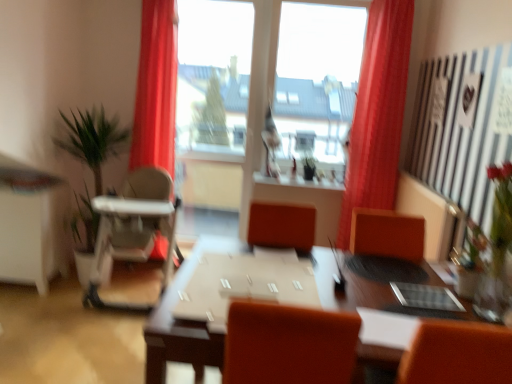
Question: Does brown wooden table at center have a lesser width compared to transparent glass window at center?

Choices:
 (A) no
 (B) yes

Answer: (A)

Question: Is brown wooden table at center completely or partially outside of transparent glass window at center?

Choices:
 (A) yes
 (B) no

Answer: (A)

Question: From a real-world perspective, does brown wooden table at center sit lower than transparent glass window at center?

Choices:
 (A) no
 (B) yes

Answer: (B)

Question: Is brown wooden table at center further to the viewer compared to transparent glass window at center?

Choices:
 (A) no
 (B) yes

Answer: (A)

Question: Considering the relative sizes of brown wooden table at center and transparent glass window at center in the image provided, is brown wooden table at center wider than transparent glass window at center?

Choices:
 (A) yes
 (B) no

Answer: (A)

Question: From a real-world perspective, is transparent glass window at center above or below clear glass vase at right?

Choices:
 (A) above
 (B) below

Answer: (A)

Question: Considering their positions, is transparent glass window at center located in front of or behind clear glass vase at right?

Choices:
 (A) behind
 (B) front

Answer: (A)

Question: From the image's perspective, relative to clear glass vase at right, is transparent glass window at center above or below?

Choices:
 (A) above
 (B) below

Answer: (A)

Question: Which is correct: transparent glass window at center is inside clear glass vase at right, or outside of it?

Choices:
 (A) inside
 (B) outside

Answer: (B)

Question: Looking at the image, does brown wooden table at center seem bigger or smaller compared to transparent glass window at center?

Choices:
 (A) small
 (B) big

Answer: (B)

Question: Relative to transparent glass window at center, is brown wooden table at center in front or behind?

Choices:
 (A) behind
 (B) front

Answer: (B)

Question: Is brown wooden table at center situated inside transparent glass window at center or outside?

Choices:
 (A) outside
 (B) inside

Answer: (A)

Question: From the image's perspective, is brown wooden table at center above or below transparent glass window at center?

Choices:
 (A) below
 (B) above

Answer: (A)

Question: Is transparent glass window at center in front of or behind green leafy plant at left in the image?

Choices:
 (A) front
 (B) behind

Answer: (B)

Question: Is transparent glass window at center taller or shorter than green leafy plant at left?

Choices:
 (A) tall
 (B) short

Answer: (A)